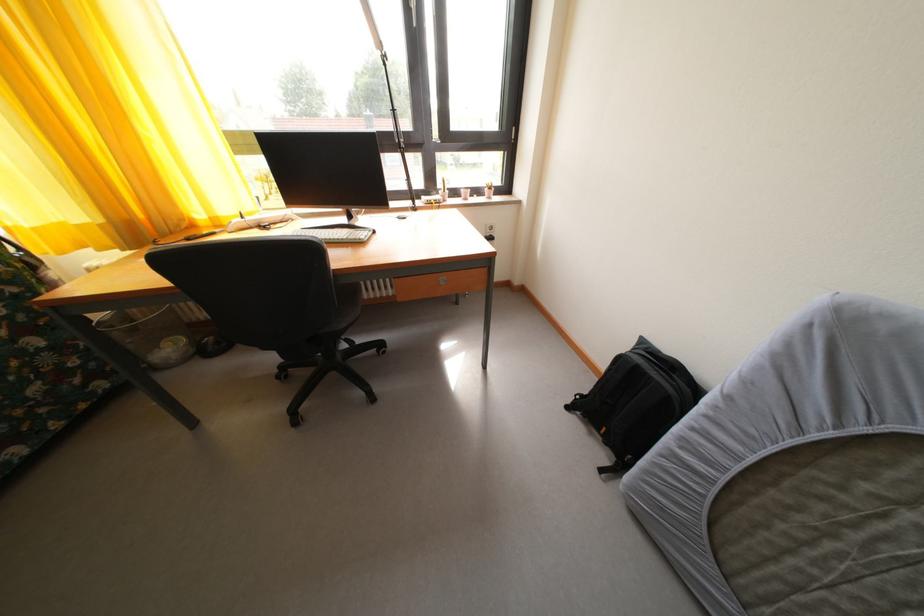
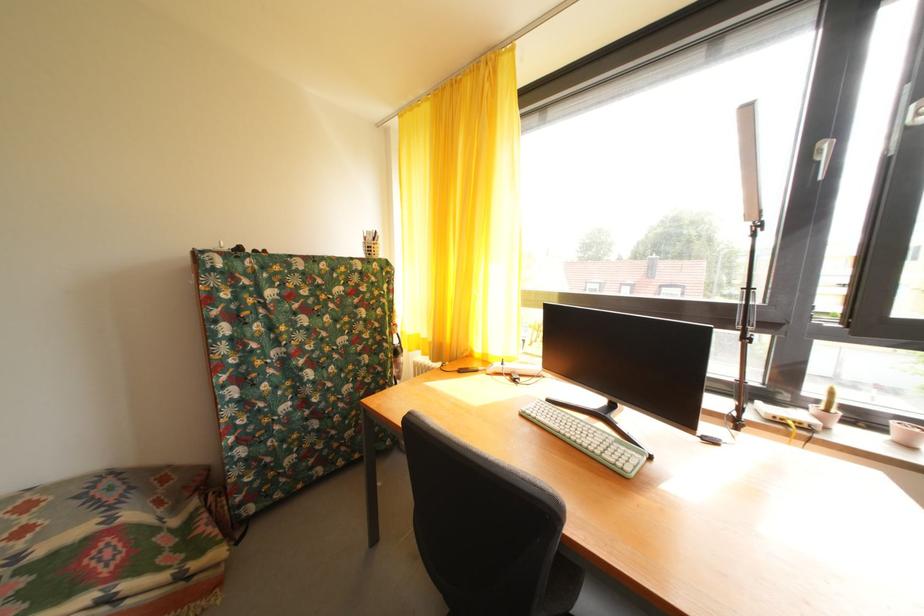
Question: The camera is either moving clockwise (left) or counter-clockwise (right) around the object. The first image is from the beginning of the video and the second image is from the end. Is the camera moving left or right when shooting the video?

Choices:
 (A) Left
 (B) Right

Answer: (B)